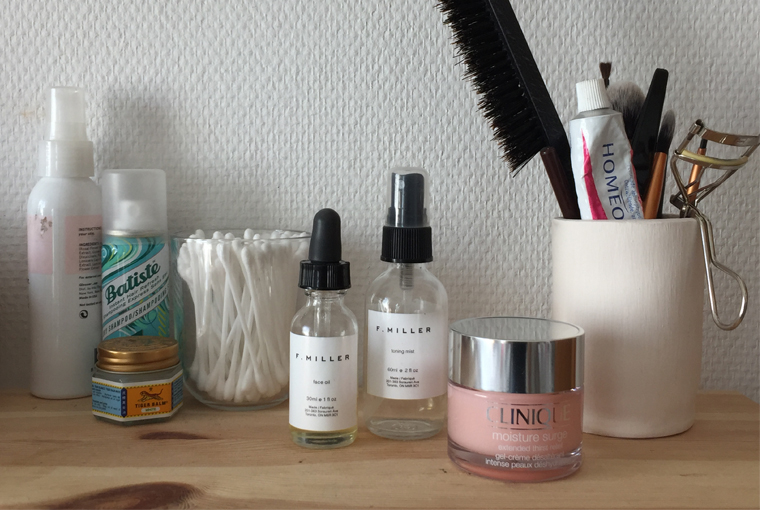
This screenshot has height=510, width=760. In order to click on white q-tips in this screenshot , I will do `click(223, 287)`.